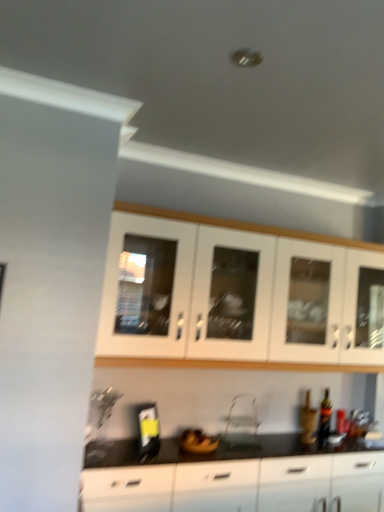
Question: Is white glass cabinet at upper center, which is the 1th cabinetry from top to bottom, a part of clear plastic folding chair at center?

Choices:
 (A) no
 (B) yes

Answer: (A)

Question: Is clear plastic folding chair at center located outside white glass cabinet at upper center, which is the 1th cabinetry from top to bottom?

Choices:
 (A) no
 (B) yes

Answer: (B)

Question: Considering the relative sizes of clear plastic folding chair at center and white glass cabinet at upper center, which is the 1th cabinetry from top to bottom, in the image provided, is clear plastic folding chair at center bigger than white glass cabinet at upper center, which is the 1th cabinetry from top to bottom,?

Choices:
 (A) no
 (B) yes

Answer: (A)

Question: Can you confirm if clear plastic folding chair at center is smaller than white glass cabinet at upper center, which is the 1th cabinetry from top to bottom?

Choices:
 (A) yes
 (B) no

Answer: (A)

Question: Is clear plastic folding chair at center turned away from white glass cabinet at upper center, placed as the second cabinetry when sorted from bottom to top?

Choices:
 (A) yes
 (B) no

Answer: (B)

Question: Can you confirm if clear plastic folding chair at center is taller than white glass cabinet at upper center, placed as the second cabinetry when sorted from bottom to top?

Choices:
 (A) yes
 (B) no

Answer: (B)

Question: Is black glossy cabinet at lower center, the 1th cabinetry when ordered from bottom to top, a part of matte glass bottle at lower right?

Choices:
 (A) no
 (B) yes

Answer: (A)

Question: Can you confirm if matte glass bottle at lower right is shorter than black glossy cabinet at lower center, the second cabinetry in the top-to-bottom sequence?

Choices:
 (A) yes
 (B) no

Answer: (A)

Question: Is matte glass bottle at lower right outside of black glossy cabinet at lower center, the 1th cabinetry when ordered from bottom to top?

Choices:
 (A) no
 (B) yes

Answer: (B)

Question: Is matte glass bottle at lower right not close to black glossy cabinet at lower center, the 1th cabinetry when ordered from bottom to top?

Choices:
 (A) no
 (B) yes

Answer: (A)

Question: Considering the relative positions of matte glass bottle at lower right and black glossy cabinet at lower center, the 1th cabinetry when ordered from bottom to top, in the image provided, is matte glass bottle at lower right to the left of black glossy cabinet at lower center, the 1th cabinetry when ordered from bottom to top, from the viewer's perspective?

Choices:
 (A) yes
 (B) no

Answer: (B)

Question: Does matte glass bottle at lower right have a smaller size compared to black glossy cabinet at lower center, the second cabinetry in the top-to-bottom sequence?

Choices:
 (A) no
 (B) yes

Answer: (B)

Question: Could black glossy cabinet at lower center, the 1th cabinetry when ordered from bottom to top, be considered to be inside white glass cabinet at upper center, which is the 1th cabinetry from top to bottom?

Choices:
 (A) yes
 (B) no

Answer: (B)